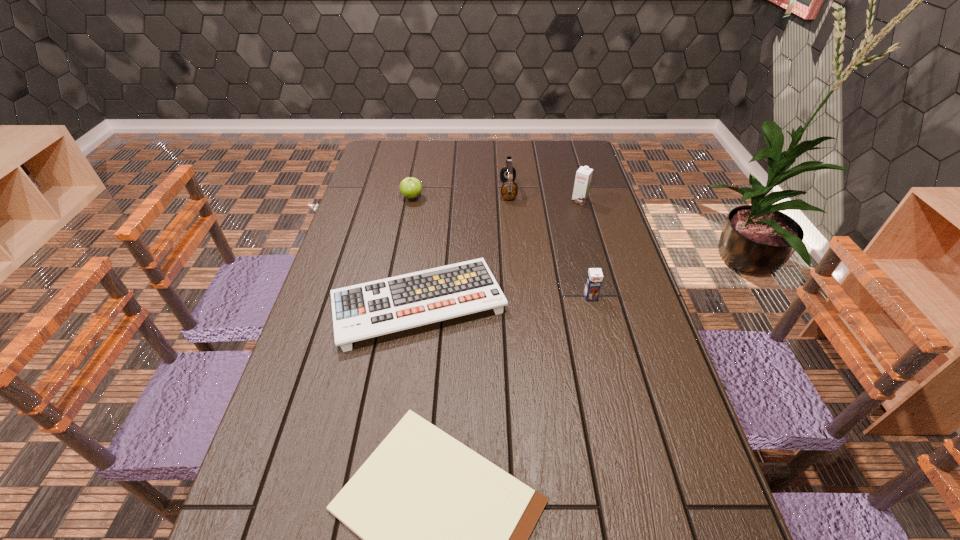
At what (x,y) coordinates should I click in order to perform the action: click on the farther chocolate milk. Please return your answer as a coordinate pair (x, y). The width and height of the screenshot is (960, 540). Looking at the image, I should click on (584, 174).

The image size is (960, 540). In order to click on headset in this screenshot , I will do `click(509, 189)`.

Where is `the nearer chocolate milk`? Image resolution: width=960 pixels, height=540 pixels. the nearer chocolate milk is located at coordinates (594, 279).

The image size is (960, 540). What are the coordinates of `apple` in the screenshot? It's located at (410, 187).

Where is `computer keyboard`? The height and width of the screenshot is (540, 960). computer keyboard is located at coordinates (376, 308).

Image resolution: width=960 pixels, height=540 pixels. What are the coordinates of `vacant position located on the back of the farther chocolate milk` in the screenshot? It's located at (565, 151).

You are a GUI agent. You are given a task and a screenshot of the screen. Output one action in this format:
    pyautogui.click(x=<x>, y=<y>)
    Task: Click on the blank area located on the ear cups of the headset
    This screenshot has height=540, width=960.
    Given the screenshot: What is the action you would take?
    pyautogui.click(x=393, y=191)

Image resolution: width=960 pixels, height=540 pixels. I want to click on vacant position located on the ear cups of the headset, so click(438, 191).

The height and width of the screenshot is (540, 960). In order to click on free space located 0.140m on the ear cups of the headset in this screenshot , I will do (463, 191).

Locate an element on the screen. free space located 0.330m on the front label of the shorter chocolate milk is located at coordinates (617, 407).